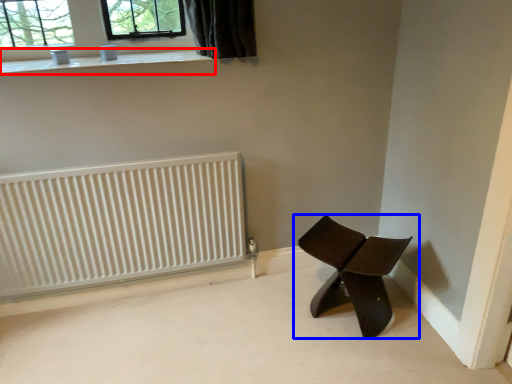
Question: Which object appears closest to the camera in this image, window sill (highlighted by a red box) or chair (highlighted by a blue box)?

Choices:
 (A) window sill
 (B) chair

Answer: (B)